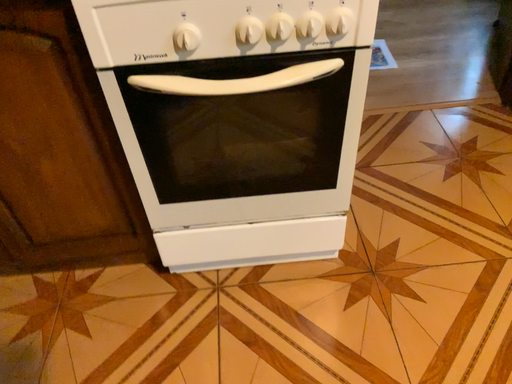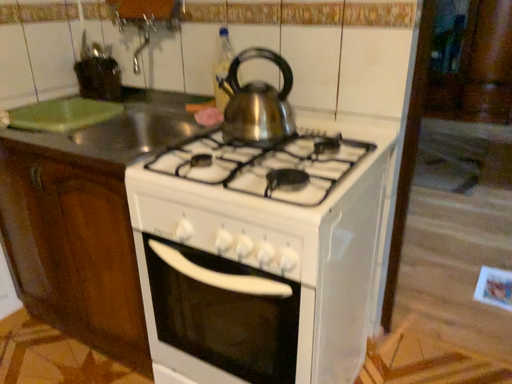
Question: Which way did the camera rotate in the video?

Choices:
 (A) rotated right
 (B) rotated left

Answer: (B)